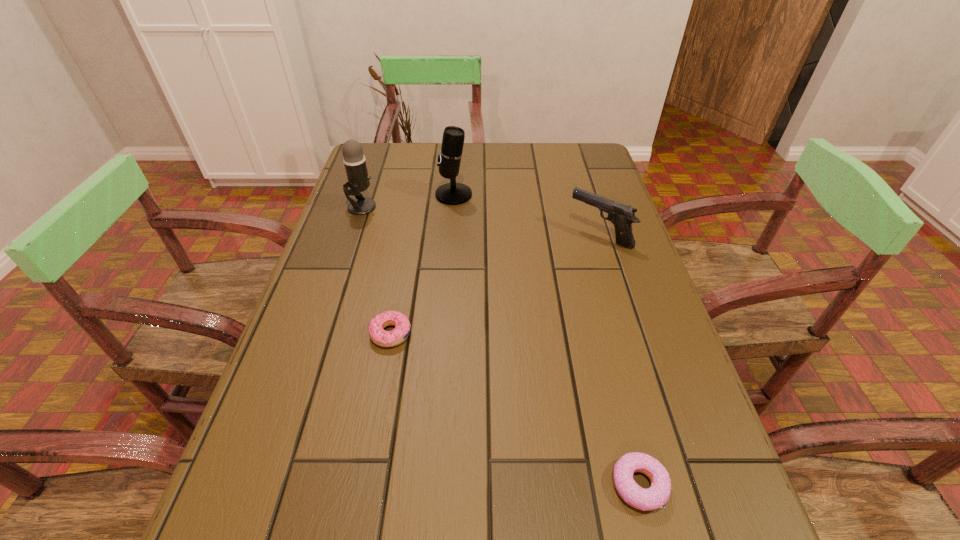
In order to click on the third object from right to left in this screenshot , I will do `click(452, 193)`.

Locate an element on the screen. the leftmost object is located at coordinates (358, 179).

I want to click on the third tallest object, so click(x=622, y=216).

The width and height of the screenshot is (960, 540). Identify the location of the third nearest object. (622, 216).

The image size is (960, 540). What are the coordinates of `the fourth object from right to left` in the screenshot? It's located at (399, 334).

The height and width of the screenshot is (540, 960). I want to click on the left doughnut, so click(x=399, y=334).

You are a GUI agent. You are given a task and a screenshot of the screen. Output one action in this format:
    pyautogui.click(x=<x>, y=<y>)
    Task: Click on the nearer doughnut
    The width and height of the screenshot is (960, 540).
    Given the screenshot: What is the action you would take?
    pyautogui.click(x=652, y=498)

This screenshot has width=960, height=540. I want to click on the right doughnut, so click(x=652, y=498).

The width and height of the screenshot is (960, 540). Identify the location of free space located 0.140m on the front of the right microphone. (450, 237).

Where is `vacant space located 0.390m on the right of the leftmost object`? This screenshot has width=960, height=540. vacant space located 0.390m on the right of the leftmost object is located at coordinates (516, 207).